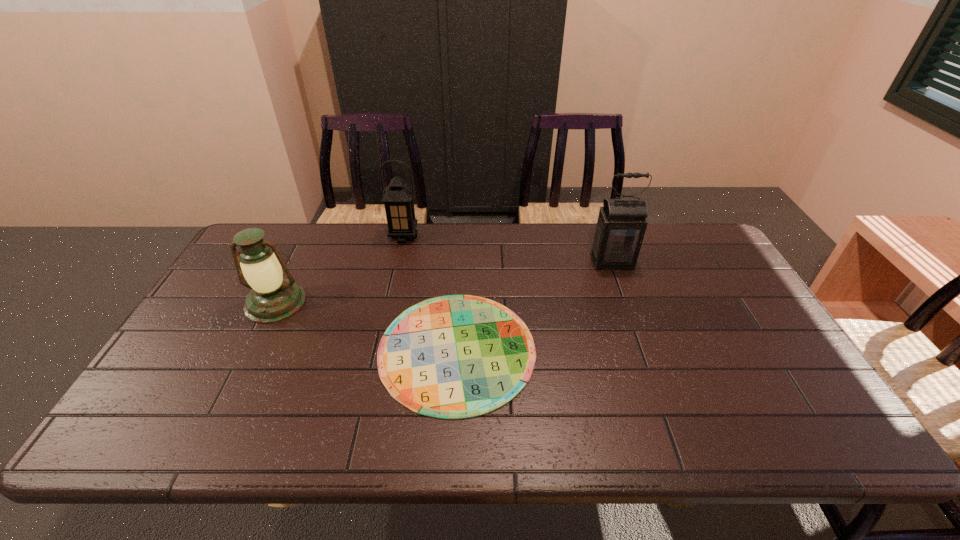
Locate an element on the screen. The width and height of the screenshot is (960, 540). vacant space located on the left of the shortest object is located at coordinates (340, 349).

Locate an element on the screen. This screenshot has width=960, height=540. object that is at the near edge is located at coordinates (457, 356).

Where is `object at the left edge`? Image resolution: width=960 pixels, height=540 pixels. object at the left edge is located at coordinates (272, 299).

Identify the location of vacant space at the far edge of the desktop. (570, 223).

Identify the location of free space at the near edge of the desktop. This screenshot has height=540, width=960. pos(483,417).

Find the location of `vacant region at the left edge of the desktop`. vacant region at the left edge of the desktop is located at coordinates (231, 283).

This screenshot has width=960, height=540. I want to click on vacant space at the right edge, so click(781, 380).

You are a GUI agent. You are given a task and a screenshot of the screen. Output one action in this format:
    pyautogui.click(x=<x>, y=<y>)
    Task: Click on the vacant space at the far left corner
    Image resolution: width=960 pixels, height=540 pixels.
    Given the screenshot: What is the action you would take?
    pyautogui.click(x=276, y=229)

In order to click on vacant space that's between the second nearest lantern and the leftmost lantern in this screenshot , I will do `click(444, 282)`.

Locate an element on the screen. free point between the farthest lantern and the leftmost object is located at coordinates [x=340, y=269].